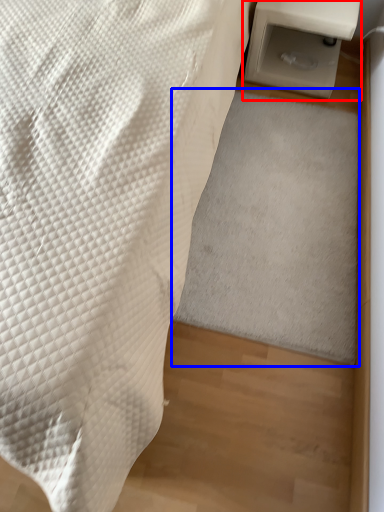
Question: Which object is further to the camera taking this photo, table (highlighted by a red box) or mat (highlighted by a blue box)?

Choices:
 (A) table
 (B) mat

Answer: (A)